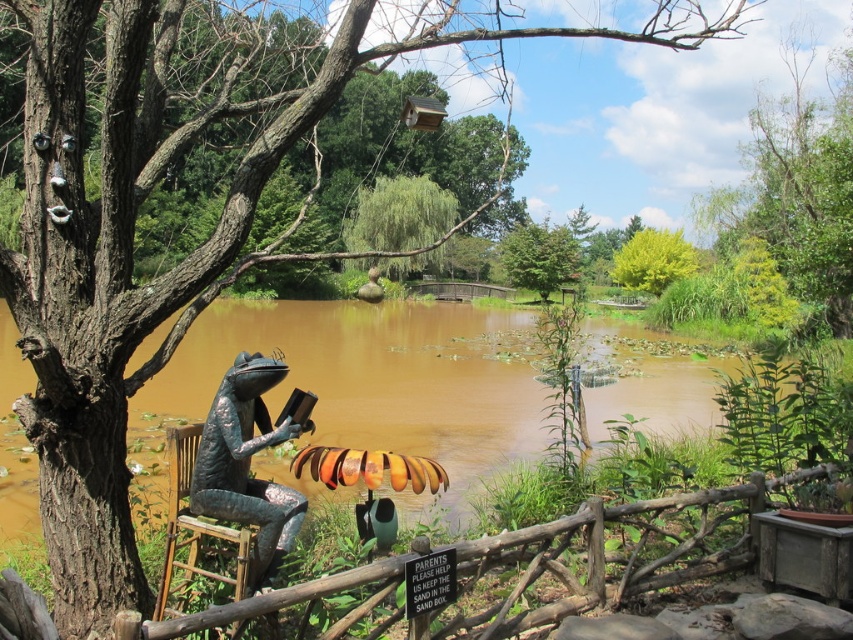
You are a bird looking for a perch. You see the green leafy tree at upper center and the shiny bronze frog at center. Which one is taller?

The green leafy tree at upper center is taller than the shiny bronze frog at center according to the description.